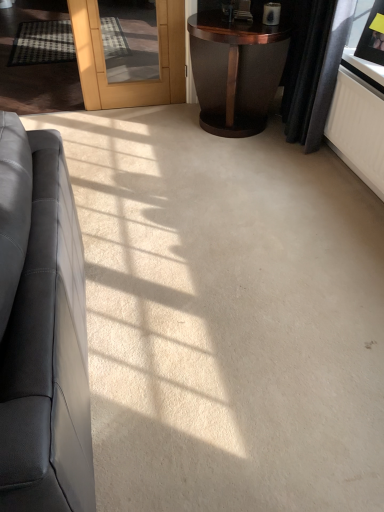
Question: Is black velvet curtain at upper right outside matte black picture frame at upper right?

Choices:
 (A) no
 (B) yes

Answer: (B)

Question: Can you confirm if black velvet curtain at upper right is wider than matte black picture frame at upper right?

Choices:
 (A) yes
 (B) no

Answer: (A)

Question: Is matte black picture frame at upper right surrounded by black velvet curtain at upper right?

Choices:
 (A) no
 (B) yes

Answer: (A)

Question: Is black velvet curtain at upper right shorter than matte black picture frame at upper right?

Choices:
 (A) no
 (B) yes

Answer: (A)

Question: Is black velvet curtain at upper right with matte black picture frame at upper right?

Choices:
 (A) no
 (B) yes

Answer: (A)

Question: Is matte black couch at left situated inside black velvet curtain at upper right or outside?

Choices:
 (A) outside
 (B) inside

Answer: (A)

Question: From a real-world perspective, is matte black couch at left above or below black velvet curtain at upper right?

Choices:
 (A) above
 (B) below

Answer: (B)

Question: Is matte black couch at left in front of or behind black velvet curtain at upper right in the image?

Choices:
 (A) front
 (B) behind

Answer: (A)

Question: Based on their positions, is matte black couch at left located to the left or right of black velvet curtain at upper right?

Choices:
 (A) right
 (B) left

Answer: (B)

Question: Considering the positions of matte black picture frame at upper right and dark wood side table at upper right in the image, is matte black picture frame at upper right taller or shorter than dark wood side table at upper right?

Choices:
 (A) tall
 (B) short

Answer: (B)

Question: Based on their sizes in the image, would you say matte black picture frame at upper right is bigger or smaller than dark wood side table at upper right?

Choices:
 (A) big
 (B) small

Answer: (B)

Question: Visually, is matte black picture frame at upper right positioned to the left or to the right of dark wood side table at upper right?

Choices:
 (A) right
 (B) left

Answer: (A)

Question: Do you think matte black picture frame at upper right is within dark wood side table at upper right, or outside of it?

Choices:
 (A) outside
 (B) inside

Answer: (A)

Question: Relative to dark wood side table at upper right, is black velvet curtain at upper right in front or behind?

Choices:
 (A) behind
 (B) front

Answer: (B)

Question: From their relative heights in the image, would you say black velvet curtain at upper right is taller or shorter than dark wood side table at upper right?

Choices:
 (A) short
 (B) tall

Answer: (B)